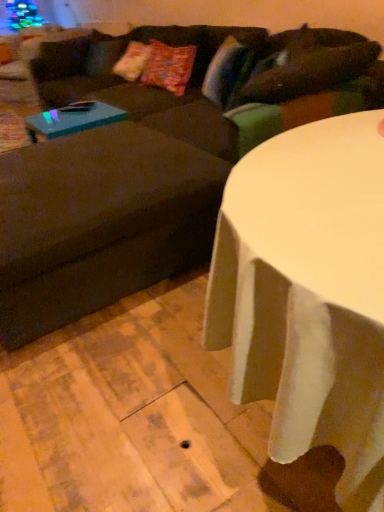
Describe the element at coordinates (308, 294) in the screenshot. The image size is (384, 512). I see `white glossy table at center` at that location.

Locate an element on the screen. This screenshot has height=512, width=384. white glossy table at center is located at coordinates (308, 294).

In order to face teal glossy coffee table at left, should I rotate leftwards or rightwards?

A 15.402 degree turn to the left will do.

Consider the image. Measure the distance between point [84,218] and camera.

Point [84,218] and camera are 1.64 meters apart from each other.

Locate an element on the screen. The height and width of the screenshot is (512, 384). white glossy table at center is located at coordinates (308, 294).

Is point (199, 119) positioned after point (335, 395)?

Yes, point (199, 119) is behind point (335, 395).

Looking at this image, considering the sizes of objects brown fabric swivel chair at left and white glossy table at center in the image provided, who is taller, brown fabric swivel chair at left or white glossy table at center?

white glossy table at center is taller.

Consider the image. Between brown fabric swivel chair at left and white glossy table at center, which one appears on the left side from the viewer's perspective?

brown fabric swivel chair at left is more to the left.

Is white glossy table at center to the left or to the right of teal glossy coffee table at left in the image?

From the image, it's evident that white glossy table at center is to the right of teal glossy coffee table at left.

Considering the relative sizes of white glossy table at center and teal glossy coffee table at left in the image provided, is white glossy table at center wider than teal glossy coffee table at left?

Indeed, white glossy table at center has a greater width compared to teal glossy coffee table at left.

Is white glossy table at center bigger than teal glossy coffee table at left?

Yes, white glossy table at center is bigger than teal glossy coffee table at left.

Could you tell me if white glossy table at center is facing teal glossy coffee table at left?

No, white glossy table at center is not facing towards teal glossy coffee table at left.

How different are the orientations of teal glossy coffee table at left and dark brown fabric couch at upper center in degrees?

The facing directions of teal glossy coffee table at left and dark brown fabric couch at upper center are 0.000913 degrees apart.

Considering the positions of points (31, 130) and (109, 255), is point (31, 130) closer to camera compared to point (109, 255)?

No, it is behind (109, 255).

Are teal glossy coffee table at left and dark brown fabric couch at upper center making contact?

No, teal glossy coffee table at left is not making contact with dark brown fabric couch at upper center.

Could you tell me if brown fabric swivel chair at left is turned towards teal glossy coffee table at left?

No, brown fabric swivel chair at left is not aimed at teal glossy coffee table at left.

Which of these two, brown fabric swivel chair at left or teal glossy coffee table at left, stands taller?

With more height is brown fabric swivel chair at left.

Which of these two, brown fabric swivel chair at left or teal glossy coffee table at left, is wider?

brown fabric swivel chair at left.

What's the angular difference between dark brown fabric couch at upper center and brown fabric swivel chair at left's facing directions?

The angular difference between dark brown fabric couch at upper center and brown fabric swivel chair at left is 0.282 degrees.

Locate an element on the screen. The height and width of the screenshot is (512, 384). swivel chair behind the dark brown fabric couch at upper center is located at coordinates (105, 216).

Is dark brown fabric couch at upper center bigger than brown fabric swivel chair at left?

Indeed, dark brown fabric couch at upper center has a larger size compared to brown fabric swivel chair at left.

Considering the sizes of objects white glossy table at center and dark brown fabric couch at upper center in the image provided, who is wider, white glossy table at center or dark brown fabric couch at upper center?

With larger width is dark brown fabric couch at upper center.

Between white glossy table at center and dark brown fabric couch at upper center, which one has more height?

dark brown fabric couch at upper center.

From the image's perspective, is white glossy table at center located above or below dark brown fabric couch at upper center?

From the image's perspective, white glossy table at center appears below dark brown fabric couch at upper center.

Measure the distance between dark brown fabric couch at upper center and teal glossy coffee table at left.

They are 27.06 inches apart.

Which is more distant, (63, 324) or (54, 123)?

Positioned behind is point (54, 123).

Who is bigger, dark brown fabric couch at upper center or teal glossy coffee table at left?

dark brown fabric couch at upper center is bigger.

Is there a large distance between dark brown fabric couch at upper center and teal glossy coffee table at left?

No, dark brown fabric couch at upper center is not far away from teal glossy coffee table at left.

This screenshot has height=512, width=384. Identify the location of table to the right of brown fabric swivel chair at left. (308, 294).

The height and width of the screenshot is (512, 384). In the image, there is a white glossy table at center. Identify the location of coffee table above it (from the image's perspective). (72, 119).

Which object lies nearer to the anchor point brown fabric swivel chair at left, white glossy table at center or dark brown fabric couch at upper center?

dark brown fabric couch at upper center lies closer to brown fabric swivel chair at left than the other object.

Looking at the image, which one is located further to teal glossy coffee table at left, brown fabric swivel chair at left or dark brown fabric couch at upper center?

Based on the image, brown fabric swivel chair at left appears to be further to teal glossy coffee table at left.

From the image, which object appears to be nearer to teal glossy coffee table at left, white glossy table at center or dark brown fabric couch at upper center?

dark brown fabric couch at upper center is positioned closer to the anchor teal glossy coffee table at left.

Based on their spatial positions, is teal glossy coffee table at left or white glossy table at center closer to dark brown fabric couch at upper center?

teal glossy coffee table at left is positioned closer to the anchor dark brown fabric couch at upper center.

When comparing their distances from teal glossy coffee table at left, does dark brown fabric couch at upper center or white glossy table at center seem closer?

dark brown fabric couch at upper center lies closer to teal glossy coffee table at left than the other object.

Looking at the image, which one is located closer to brown fabric swivel chair at left, white glossy table at center or teal glossy coffee table at left?

teal glossy coffee table at left lies closer to brown fabric swivel chair at left than the other object.

From the image, which object appears to be farther from brown fabric swivel chair at left, teal glossy coffee table at left or white glossy table at center?

white glossy table at center.

Based on their spatial positions, is dark brown fabric couch at upper center or brown fabric swivel chair at left further from teal glossy coffee table at left?

Among the two, brown fabric swivel chair at left is located further to teal glossy coffee table at left.

This screenshot has width=384, height=512. What are the coordinates of `swivel chair positioned between dark brown fabric couch at upper center and teal glossy coffee table at left from near to far` in the screenshot? It's located at (105, 216).

At what (x,y) coordinates should I click in order to perform the action: click on swivel chair between dark brown fabric couch at upper center and white glossy table at center. Please return your answer as a coordinate pair (x, y). The width and height of the screenshot is (384, 512). Looking at the image, I should click on (105, 216).

This screenshot has width=384, height=512. What are the coordinates of `studio couch between white glossy table at center and teal glossy coffee table at left in the front-back direction` in the screenshot? It's located at (154, 160).

Identify the location of swivel chair between white glossy table at center and teal glossy coffee table at left along the z-axis. (105, 216).